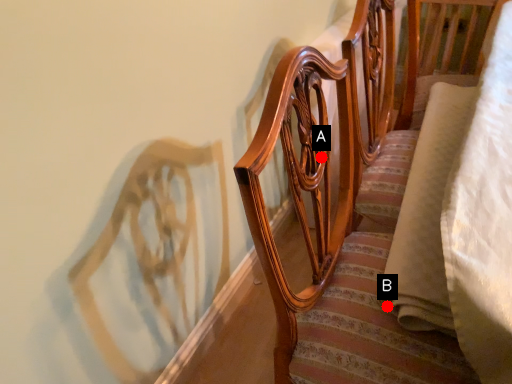
Question: Two points are circled on the image, labeled by A and B beside each circle. Which of the following is the farthest from the observer?

Choices:
 (A) A is further
 (B) B is further

Answer: (A)